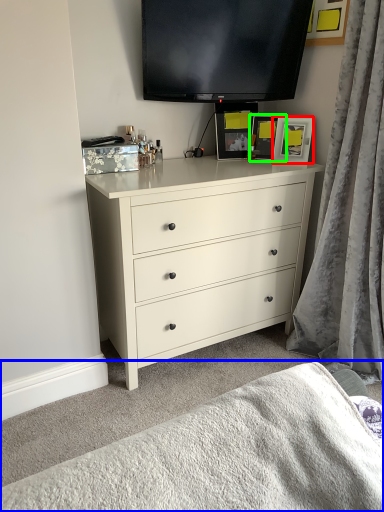
Question: Which object is the farthest from picture frame (highlighted by a red box)? Choose among these: bedding (highlighted by a blue box) or picture frame (highlighted by a green box).

Choices:
 (A) bedding
 (B) picture frame

Answer: (A)